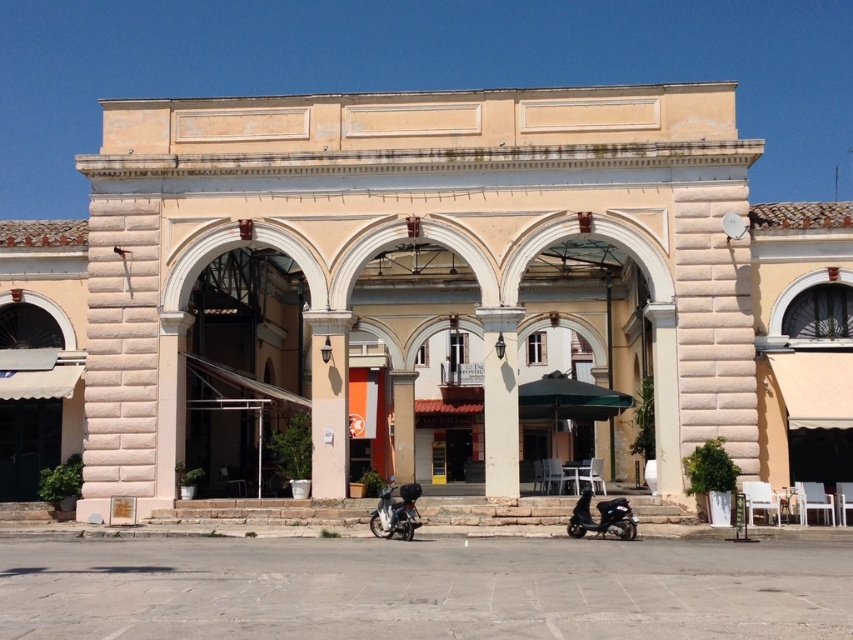
You are a delivery person with a package that needs to be placed 5 meters away from the white stone column at center. You see the metallic silver scooter at center in the scene. Can you place the package near the scooter without exceeding the 5 meter distance requirement?

The distance between the white stone column at center and the metallic silver scooter at center is 5.16 meters. Since 5.16 meters is greater than the 5 meter requirement, placing the package near the scooter would exceed the allowed distance. You need to find a closer spot.

You are standing in front of the classical building and want to take a photo that includes the white stone column at center. If you position your camera at the very front edge of the building, will the column be centered in your photo?

The white stone column at center is located at coordinates approximately 0.628 on the x axis and 0.587 on the y axis. Since the column is not exactly at the center point of the image, positioning the camera at the front edge may not center it perfectly in the photo.

You are an architect visiting this classical building and notice the white stone column at center and the shiny black scooter at lower center. Which object would cast a longer shadow during midday when the sun is directly overhead?

The white stone column at center is larger in size than the shiny black scooter at lower center, so it would cast a longer shadow during midday when the sun is directly overhead.